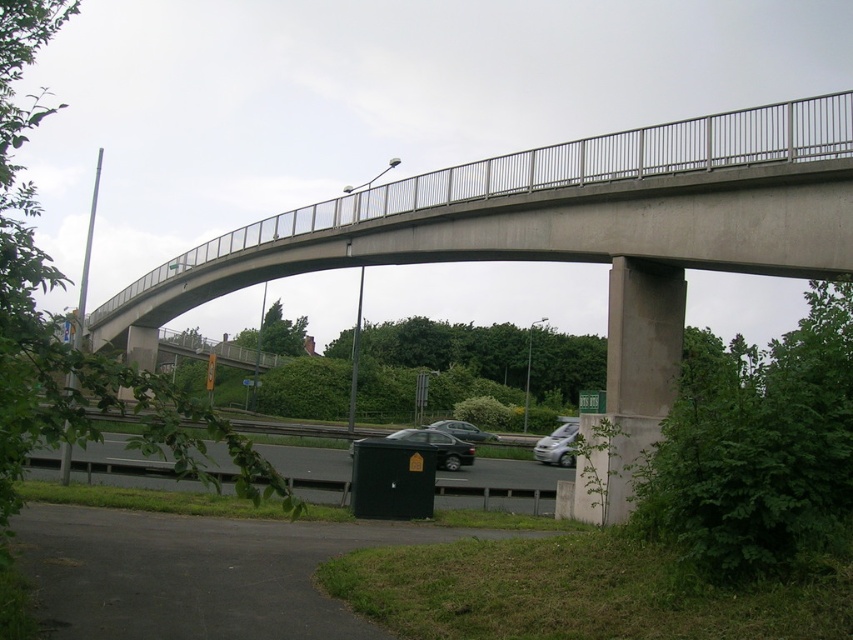
You are standing at the base of the curved concrete bridge and see the point marked at coordinates (439, 445). What object is located at that point?

The point at coordinates (439, 445) marks the shiny black sedan at center.